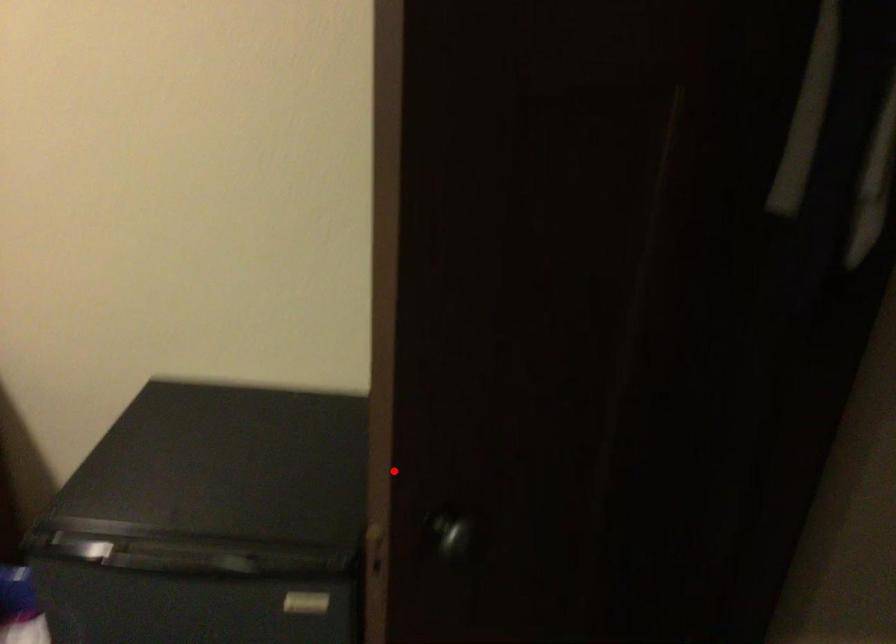
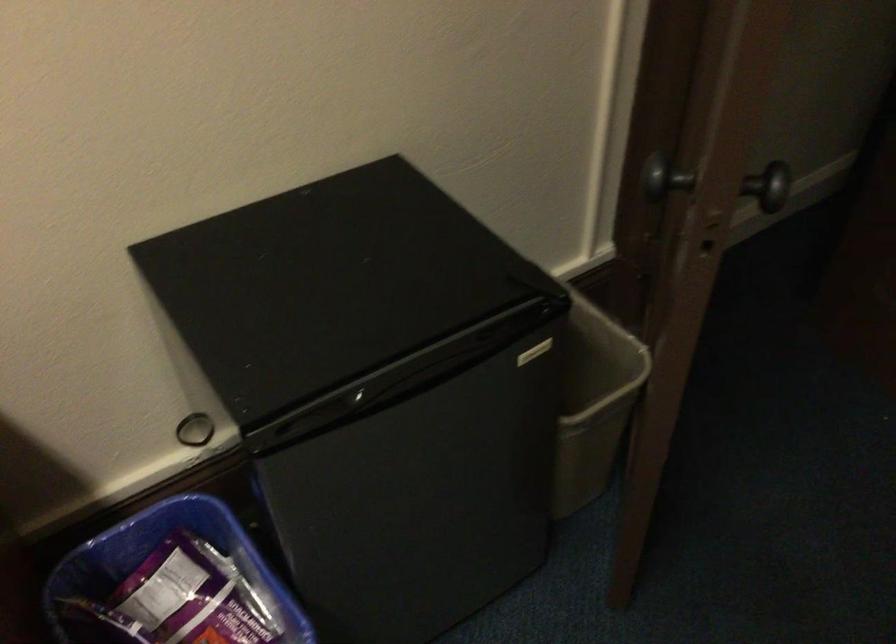
Question: I am providing you with two images of the same scene from different viewpoints. In image1, a red point is highlighted. Considering the same 3D point in image2, which of the following is correct?

Choices:
 (A) It is closer
 (B) It is farther

Answer: (B)